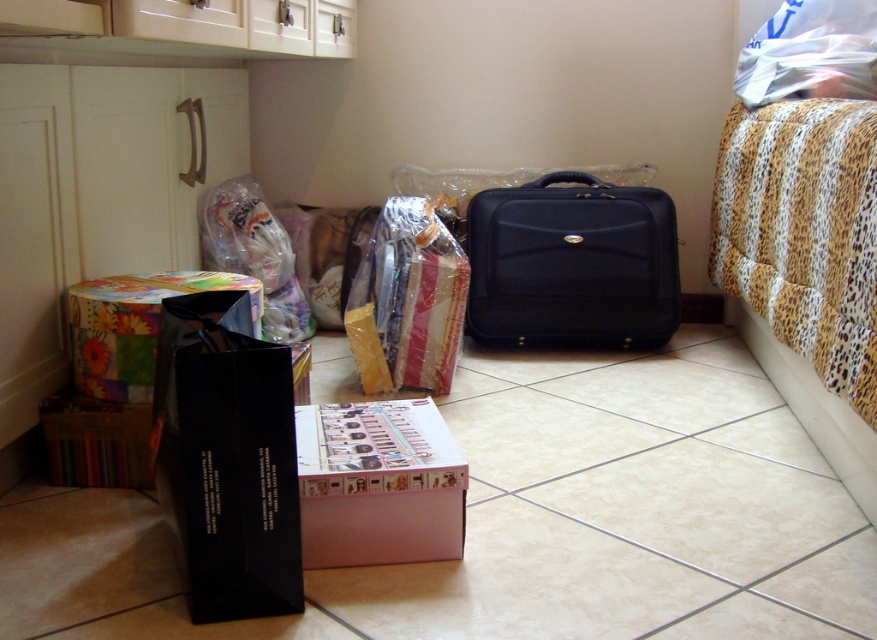
Question: Is black glossy bag at lower left below pink cardboard box at center?

Choices:
 (A) no
 (B) yes

Answer: (A)

Question: Can you confirm if black glossy bag at lower left is bigger than translucent plastic bag at upper left?

Choices:
 (A) no
 (B) yes

Answer: (A)

Question: Which point appears farthest from the camera in this image?

Choices:
 (A) (87, 388)
 (B) (325, 468)
 (C) (289, 241)

Answer: (C)

Question: Which object is the farthest from the matte cardboard box at lower left?

Choices:
 (A) matte black briefcase at center
 (B) matte plastic bag at center

Answer: (A)

Question: Which object is closer to the camera taking this photo?

Choices:
 (A) translucent plastic bag at upper left
 (B) matte cardboard box at lower left
 (C) black glossy bag at lower left
 (D) matte plastic bag at center

Answer: (C)

Question: Does matte black briefcase at center have a greater width compared to metallic glossy box at lower left?

Choices:
 (A) no
 (B) yes

Answer: (B)